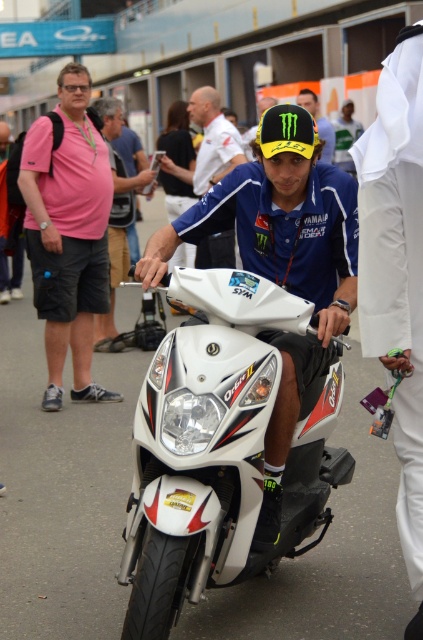
Question: Among these objects, which one is nearest to the camera?

Choices:
 (A) matte pink shirt at left
 (B) white glossy motorcycle at center
 (C) blue jersey at center

Answer: (B)

Question: Where is pink cotton shirt at left located in relation to matte blue helmet at center in the image?

Choices:
 (A) left
 (B) right

Answer: (A)

Question: Which of the following is the closest to the observer?

Choices:
 (A) (387, 147)
 (B) (266, 99)

Answer: (A)

Question: Which point is farther to the camera?

Choices:
 (A) yellow matte helmet at center
 (B) matte blue helmet at center

Answer: (B)

Question: Can you confirm if white glossy motorcycle at center is smaller than white matte motorcycle at center?

Choices:
 (A) yes
 (B) no

Answer: (B)

Question: Where is white glossy motorcycle at center located in relation to matte blue helmet at center in the image?

Choices:
 (A) right
 (B) left

Answer: (B)